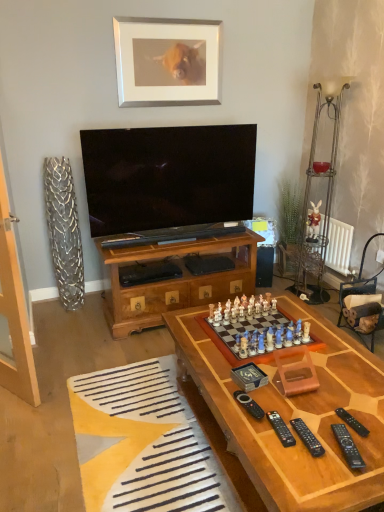
The image size is (384, 512). Identify the location of vacant space in front of black plastic remote at lower right, the fourth remote when ordered from left to right. (346, 481).